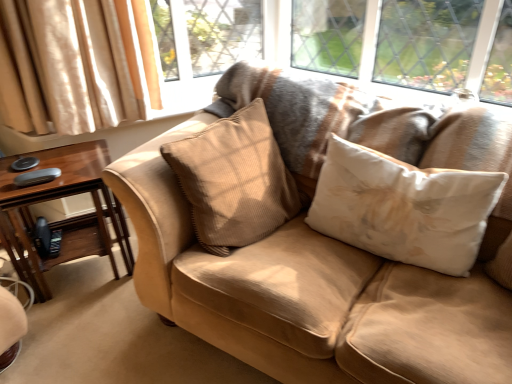
Question: Does brown wood table at left have a lesser width compared to white fabric pillow at center, acting as the 2th pillow starting from the left?

Choices:
 (A) yes
 (B) no

Answer: (B)

Question: Does brown wood table at left lie behind white fabric pillow at center, which is the first pillow from right to left?

Choices:
 (A) no
 (B) yes

Answer: (B)

Question: Is brown wood table at left shorter than white fabric pillow at center, which is the first pillow from right to left?

Choices:
 (A) yes
 (B) no

Answer: (B)

Question: Is brown wood table at left aimed at white fabric pillow at center, which is the first pillow from right to left?

Choices:
 (A) no
 (B) yes

Answer: (A)

Question: Is brown wood table at left located outside white fabric pillow at center, which is the first pillow from right to left?

Choices:
 (A) yes
 (B) no

Answer: (A)

Question: Would you say beige corduroy pillow at center, which appears as the 1th pillow when viewed from the left, is to the left or to the right of suede couch at center in the picture?

Choices:
 (A) right
 (B) left

Answer: (B)

Question: In terms of width, does beige corduroy pillow at center, which appears as the 1th pillow when viewed from the left, look wider or thinner when compared to suede couch at center?

Choices:
 (A) wide
 (B) thin

Answer: (B)

Question: From a real-world perspective, is beige corduroy pillow at center, which is the second pillow in right-to-left order, above or below suede couch at center?

Choices:
 (A) below
 (B) above

Answer: (B)

Question: Is beige corduroy pillow at center, which is the second pillow in right-to-left order, bigger or smaller than suede couch at center?

Choices:
 (A) big
 (B) small

Answer: (B)

Question: Is beige corduroy pillow at center, which appears as the 1th pillow when viewed from the left, taller or shorter than brown wood table at left?

Choices:
 (A) short
 (B) tall

Answer: (A)

Question: Is beige corduroy pillow at center, which appears as the 1th pillow when viewed from the left, to the left or to the right of brown wood table at left in the image?

Choices:
 (A) right
 (B) left

Answer: (A)

Question: Considering the positions of beige corduroy pillow at center, which is the second pillow in right-to-left order, and brown wood table at left in the image, is beige corduroy pillow at center, which is the second pillow in right-to-left order, bigger or smaller than brown wood table at left?

Choices:
 (A) small
 (B) big

Answer: (A)

Question: Choose the correct answer: Is beige corduroy pillow at center, which is the second pillow in right-to-left order, inside brown wood table at left or outside it?

Choices:
 (A) inside
 (B) outside

Answer: (B)

Question: Looking at the image, does white fabric pillow at center, acting as the 2th pillow starting from the left, seem bigger or smaller compared to suede couch at center?

Choices:
 (A) big
 (B) small

Answer: (B)

Question: Based on their positions, is white fabric pillow at center, acting as the 2th pillow starting from the left, located to the left or right of suede couch at center?

Choices:
 (A) left
 (B) right

Answer: (B)